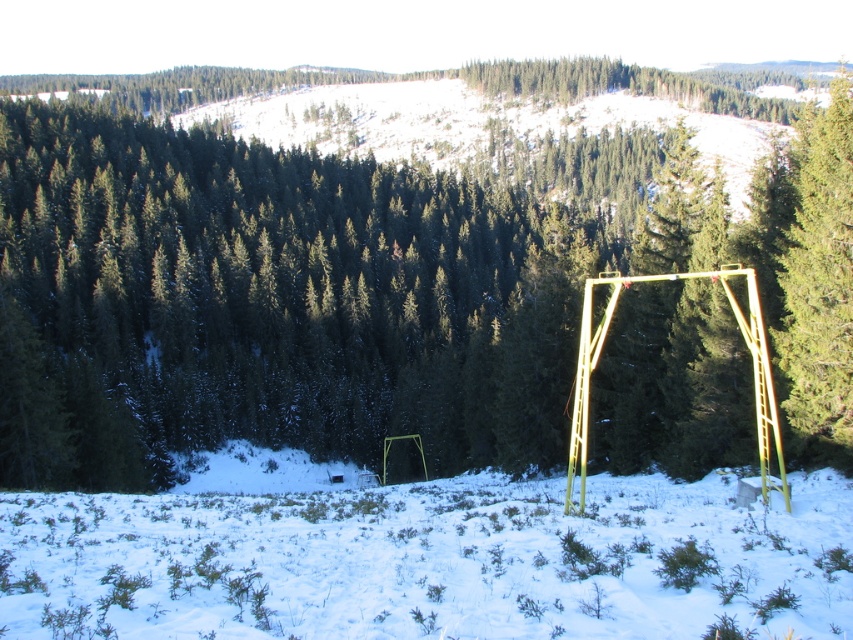
You are a parent trying to decide if your child can safely play on the green matte swing at center while standing on the white powdery snow at lower center. Based on the scene, can the child reach the swing from the snow without stepping off the snow?

The green matte swing at center is located above the white powdery snow at lower center, so the child can safely reach the swing from the snow without needing to step off the snow.